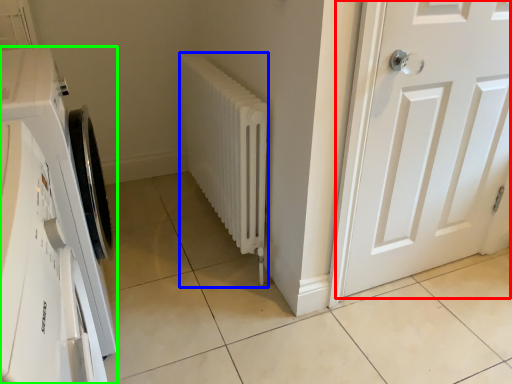
Question: Based on their relative distances, which object is farther from door (highlighted by a red box)? Choose from radiator (highlighted by a blue box) and washing machine (highlighted by a green box).

Choices:
 (A) radiator
 (B) washing machine

Answer: (B)